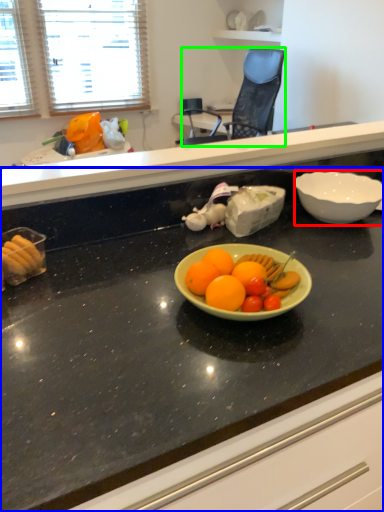
Question: Which object is the closest to the bowl (highlighted by a red box)? Choose among these: countertop (highlighted by a blue box) or chair (highlighted by a green box).

Choices:
 (A) countertop
 (B) chair

Answer: (A)